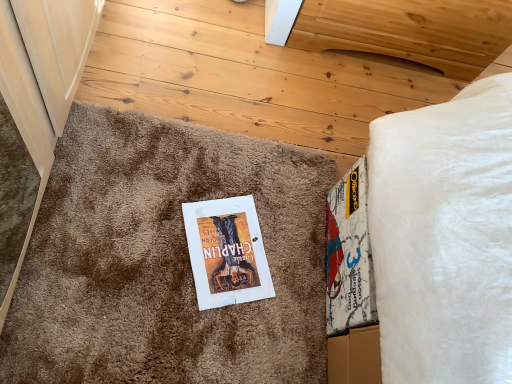
In order to click on natural wood headboard at upper center in this screenshot , I will do `click(408, 30)`.

Would you say white paper book at center is part of brown shaggy carpet at center's contents?

Indeed, white paper book at center is located within brown shaggy carpet at center.

Does brown shaggy carpet at center have a greater width compared to white paper book at center?

Yes, brown shaggy carpet at center is wider than white paper book at center.

From a real-world perspective, is brown shaggy carpet at center physically below white paper book at center?

No, from a real-world perspective, brown shaggy carpet at center is not below white paper book at center.

Considering the points (127, 254) and (237, 209), which point is in front, point (127, 254) or point (237, 209)?

The point (127, 254) is in front.

Considering the relative sizes of natural wood headboard at upper center and white paper book at center in the image provided, is natural wood headboard at upper center shorter than white paper book at center?

Incorrect, the height of natural wood headboard at upper center does not fall short of that of white paper book at center.

In the image, there is a white paper book at center. Identify the location of furniture above it (from the image's perspective). The image size is (512, 384). (408, 30).

From the image's perspective, is natural wood headboard at upper center above or below white paper book at center?

Clearly, from the image's perspective, natural wood headboard at upper center is above white paper book at center.

Looking at this image, can you see natural wood headboard at upper center touching white paper book at center?

No, natural wood headboard at upper center is not making contact with white paper book at center.

Is the position of white paper book at center less distant than that of brown shaggy carpet at center?

No, it is not.

Between point (245, 300) and point (137, 260), which one is positioned in front?

Positioned in front is point (137, 260).

Which object is closer to the camera taking this photo, brown shaggy carpet at center or natural wood headboard at upper center?

brown shaggy carpet at center is in front.

Which of these two, brown shaggy carpet at center or natural wood headboard at upper center, is wider?

With larger width is brown shaggy carpet at center.

In terms of size, does brown shaggy carpet at center appear bigger or smaller than natural wood headboard at upper center?

brown shaggy carpet at center is smaller than natural wood headboard at upper center.

Image resolution: width=512 pixels, height=384 pixels. In the image, there is a brown shaggy carpet at center. Identify the location of furniture above it (from the image's perspective). (408, 30).

Is natural wood headboard at upper center positioned far away from brown shaggy carpet at center?

No, natural wood headboard at upper center is not far away from brown shaggy carpet at center.

Between natural wood headboard at upper center and brown shaggy carpet at center, which one appears on the right side from the viewer's perspective?

natural wood headboard at upper center is more to the right.

Is natural wood headboard at upper center further to camera compared to brown shaggy carpet at center?

Yes.

Who is bigger, white paper book at center or natural wood headboard at upper center?

With larger size is natural wood headboard at upper center.

Consider the image. From a real-world perspective, between white paper book at center and natural wood headboard at upper center, who is vertically higher?

natural wood headboard at upper center is physically above.

Would you say natural wood headboard at upper center is part of white paper book at center's contents?

No, natural wood headboard at upper center is located outside of white paper book at center.

Find the location of `doormat on the left side of white paper book at center`. doormat on the left side of white paper book at center is located at coordinates (165, 260).

Image resolution: width=512 pixels, height=384 pixels. Identify the location of furniture located above the white paper book at center (from a real-world perspective). (408, 30).

Which object lies further to the anchor point white paper book at center, brown shaggy carpet at center or natural wood headboard at upper center?

natural wood headboard at upper center lies further to white paper book at center than the other object.

From the image, which object appears to be nearer to brown shaggy carpet at center, natural wood headboard at upper center or white paper book at center?

white paper book at center is positioned closer to the anchor brown shaggy carpet at center.

Estimate the real-world distances between objects in this image. Which object is closer to white paper book at center, natural wood headboard at upper center or brown shaggy carpet at center?

The object closer to white paper book at center is brown shaggy carpet at center.

From the image, which object appears to be nearer to natural wood headboard at upper center, white paper book at center or brown shaggy carpet at center?

brown shaggy carpet at center is positioned closer to the anchor natural wood headboard at upper center.

Which object lies nearer to the anchor point natural wood headboard at upper center, brown shaggy carpet at center or white paper book at center?

The object closer to natural wood headboard at upper center is brown shaggy carpet at center.

Considering their positions, is white paper book at center positioned closer to brown shaggy carpet at center than natural wood headboard at upper center?

white paper book at center is positioned closer to the anchor brown shaggy carpet at center.

Identify the location of doormat that lies between natural wood headboard at upper center and white paper book at center from top to bottom. (165, 260).